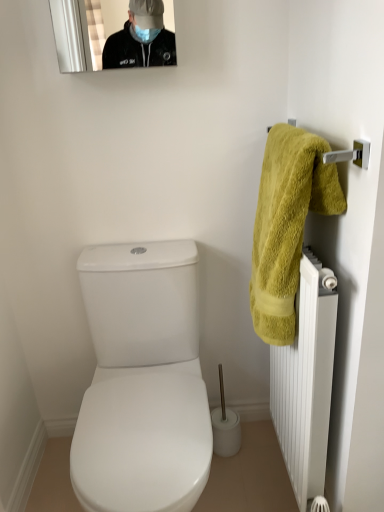
Question: From a real-world perspective, is white matte radiator at right beneath white plastic toilet brush at center?

Choices:
 (A) yes
 (B) no

Answer: (B)

Question: Is white matte radiator at right positioned in front of white plastic toilet brush at center?

Choices:
 (A) yes
 (B) no

Answer: (A)

Question: Is white matte radiator at right not within white plastic toilet brush at center?

Choices:
 (A) no
 (B) yes

Answer: (B)

Question: Is white matte radiator at right taller than white plastic toilet brush at center?

Choices:
 (A) no
 (B) yes

Answer: (B)

Question: Does white matte radiator at right lie behind white plastic toilet brush at center?

Choices:
 (A) yes
 (B) no

Answer: (B)

Question: Can you confirm if white matte radiator at right is smaller than white plastic toilet brush at center?

Choices:
 (A) no
 (B) yes

Answer: (A)

Question: From a real-world perspective, is yellow fluffy towel at right under white plastic toilet brush at center?

Choices:
 (A) no
 (B) yes

Answer: (A)

Question: Is yellow fluffy towel at right further to camera compared to white plastic toilet brush at center?

Choices:
 (A) no
 (B) yes

Answer: (A)

Question: Is yellow fluffy towel at right at the left side of white plastic toilet brush at center?

Choices:
 (A) yes
 (B) no

Answer: (B)

Question: Can you confirm if yellow fluffy towel at right is positioned to the right of white plastic toilet brush at center?

Choices:
 (A) yes
 (B) no

Answer: (A)

Question: Is yellow fluffy towel at right smaller than white plastic toilet brush at center?

Choices:
 (A) yes
 (B) no

Answer: (B)

Question: From the image's perspective, is yellow fluffy towel at right under white plastic toilet brush at center?

Choices:
 (A) no
 (B) yes

Answer: (A)

Question: Does white plastic toilet brush at center have a greater height compared to yellow fluffy towel at right?

Choices:
 (A) no
 (B) yes

Answer: (A)